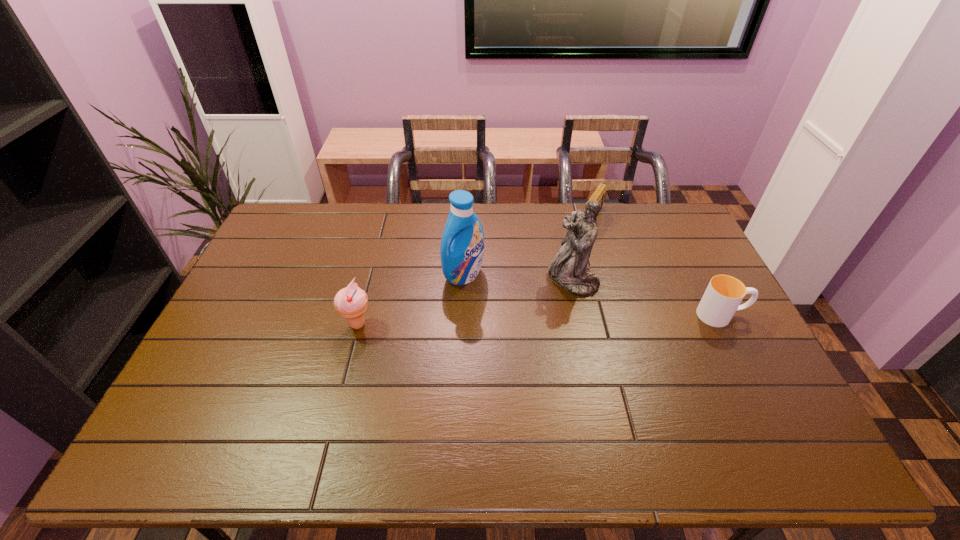
Where is `blank region between the icecream and the second object from left to right`? This screenshot has height=540, width=960. blank region between the icecream and the second object from left to right is located at coordinates (411, 300).

Identify the location of empty space between the third tallest object and the figurine. The image size is (960, 540). (466, 302).

This screenshot has width=960, height=540. Identify the location of object that can be found as the closest to the detergent. (568, 269).

Identify which object is the third closest to the rightmost object. Please provide its 2D coordinates. Your answer should be formatted as a tuple, i.e. [(x, y)], where the tuple contains the x and y coordinates of a point satisfying the conditions above.

[(462, 245)]

Locate an element on the screen. Image resolution: width=960 pixels, height=540 pixels. vacant area that satisfies the following two spatial constraints: 1. on the front side of the figurine; 2. on the left side of the detergent is located at coordinates (464, 280).

Where is `vacant space that satisfies the following two spatial constraints: 1. on the front side of the rightmost object; 2. with the handle on the side of the figurine`? vacant space that satisfies the following two spatial constraints: 1. on the front side of the rightmost object; 2. with the handle on the side of the figurine is located at coordinates (581, 315).